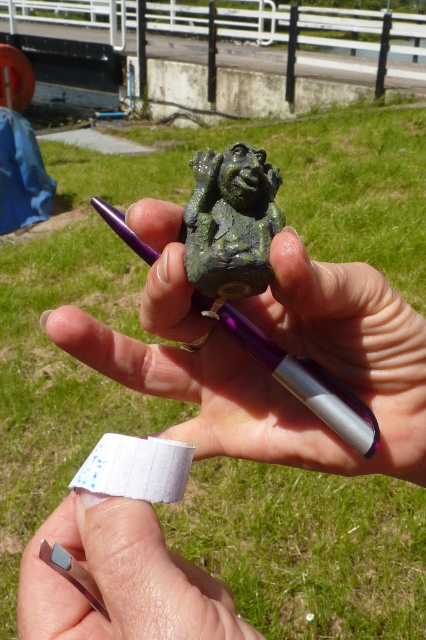
Question: Which object appears farthest from the camera in this image?

Choices:
 (A) white adhesive tape at center
 (B) purple metallic pen at center

Answer: (B)

Question: In this image, where is nail polish at center located relative to purple metallic pen at center?

Choices:
 (A) above
 (B) below

Answer: (B)

Question: Among these objects, which one is farthest from the camera?

Choices:
 (A) purple metallic pen at center
 (B) green patina stone statue at center
 (C) nail polish at center

Answer: (A)

Question: Among these points, which one is nearest to the camera?

Choices:
 (A) (330, 381)
 (B) (157, 468)

Answer: (B)

Question: Does purple metallic pen at center appear on the right side of white adhesive tape at center?

Choices:
 (A) yes
 (B) no

Answer: (A)

Question: Can you confirm if purple metallic pen at center is positioned below white adhesive tape at center?

Choices:
 (A) no
 (B) yes

Answer: (A)